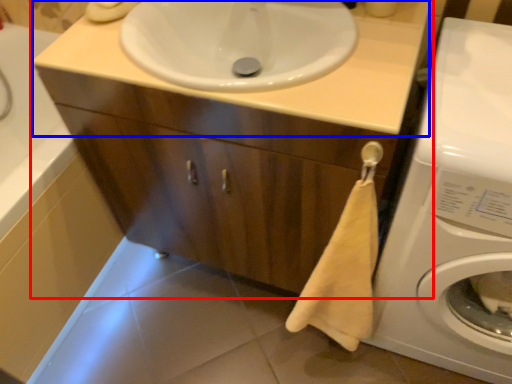
Question: Which point is closer to the camera, bathroom cabinet (highlighted by a red box) or counter top (highlighted by a blue box)?

Choices:
 (A) bathroom cabinet
 (B) counter top

Answer: (A)